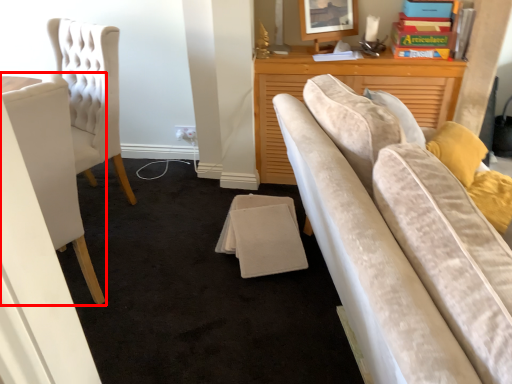
Question: Considering the relative positions of chair (annotated by the red box) and picture frame in the image provided, where is chair (annotated by the red box) located with respect to the staircase?

Choices:
 (A) left
 (B) right

Answer: (A)